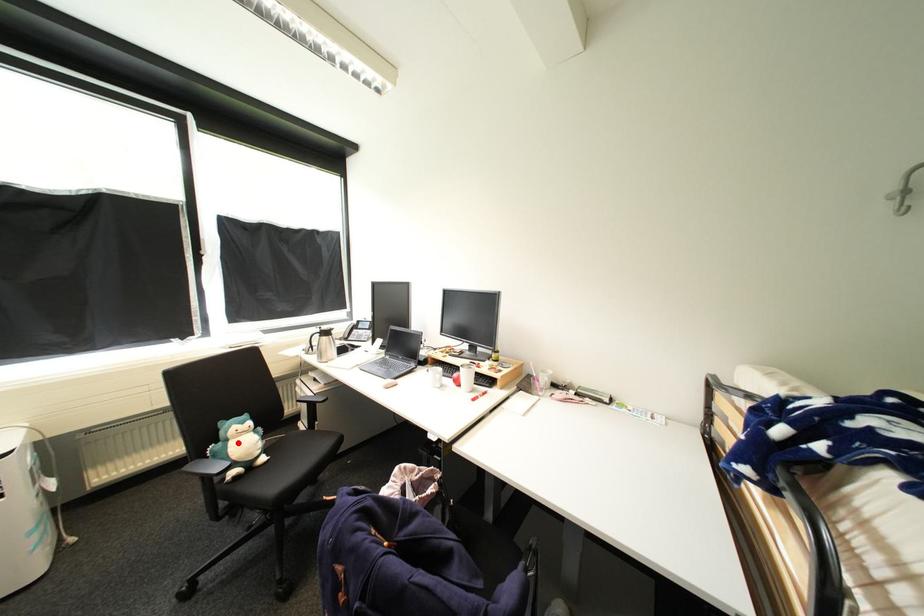
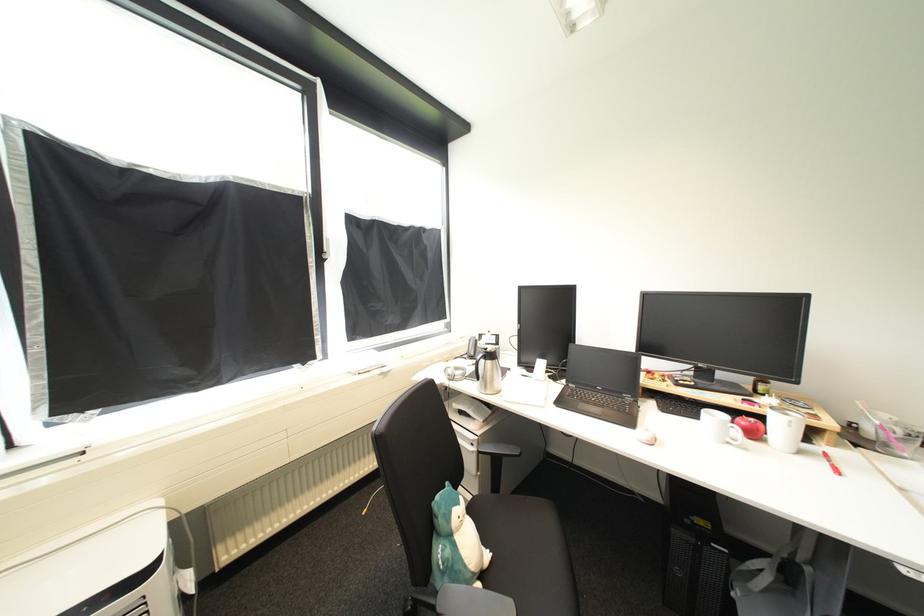
Question: I am providing you with two images of the same scene from different viewpoints. Image1 has a red point marked. In image2, the corresponding 3D location appears at what relative position? Reply with the corresponding letter.

Choices:
 (A) Closer
 (B) Farther

Answer: (B)